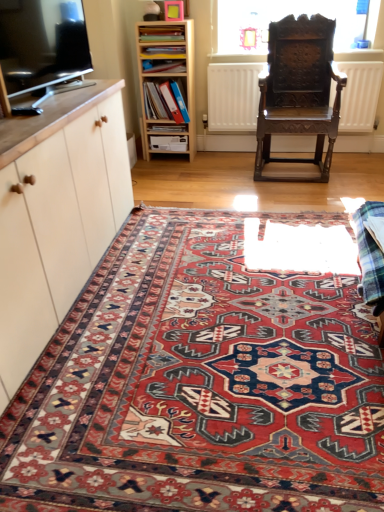
You are a GUI agent. You are given a task and a screenshot of the screen. Output one action in this format:
    pyautogui.click(x=<x>, y=<y>)
    Task: Click on the matte white cabinet at left
    This screenshot has width=384, height=512.
    Given the screenshot: What is the action you would take?
    pyautogui.click(x=58, y=218)

Image resolution: width=384 pixels, height=512 pixels. Identify the location of matte wooden bookshelf at upper center, the fourth book when ordered from bottom to top. (161, 33).

The width and height of the screenshot is (384, 512). What do you see at coordinates (299, 91) in the screenshot? I see `dark brown wood chair at center` at bounding box center [299, 91].

What do you see at coordinates (370, 253) in the screenshot?
I see `plaid fabric at lower right` at bounding box center [370, 253].

Image resolution: width=384 pixels, height=512 pixels. What do you see at coordinates (168, 128) in the screenshot? I see `matte cardboard book at center, the fourth book positioned from the top` at bounding box center [168, 128].

What do you see at coordinates (42, 42) in the screenshot? I see `black glossy tv at upper left` at bounding box center [42, 42].

Locate an element on the screen. matte white cabinet at left is located at coordinates (58, 218).

Is dark brown wood chair at center wider than matte plastic book at upper center, the 3th book in the bottom-to-top sequence?

Indeed, dark brown wood chair at center has a greater width compared to matte plastic book at upper center, the 3th book in the bottom-to-top sequence.

Is dark brown wood chair at center to the left or to the right of matte plastic book at upper center, acting as the 2th book starting from the top, in the image?

Based on their positions, dark brown wood chair at center is located to the right of matte plastic book at upper center, acting as the 2th book starting from the top.

From the picture: Which of these two, dark brown wood chair at center or matte plastic book at upper center, the 3th book in the bottom-to-top sequence, stands taller?

With more height is dark brown wood chair at center.

From the image's perspective, is dark brown wood chair at center located beneath matte plastic book at upper center, acting as the 2th book starting from the top?

Yes, from the image's perspective, dark brown wood chair at center is beneath matte plastic book at upper center, acting as the 2th book starting from the top.

From the image's perspective, relative to matte wooden bookshelf at upper center, the fourth book when ordered from bottom to top, is white matte radiator at center above or below?

white matte radiator at center is situated lower than matte wooden bookshelf at upper center, the fourth book when ordered from bottom to top, in the image.

Measure the distance between white matte radiator at center and matte wooden bookshelf at upper center, which appears as the first book when viewed from the top.

white matte radiator at center and matte wooden bookshelf at upper center, which appears as the first book when viewed from the top, are 21.80 inches apart from each other.

Visually, is white matte radiator at center positioned to the left or to the right of matte wooden bookshelf at upper center, the fourth book when ordered from bottom to top?

Clearly, white matte radiator at center is on the right of matte wooden bookshelf at upper center, the fourth book when ordered from bottom to top, in the image.

Where is `radiator that is under the matte wooden bookshelf at upper center, the fourth book when ordered from bottom to top (from a real-world perspective)`? The height and width of the screenshot is (512, 384). radiator that is under the matte wooden bookshelf at upper center, the fourth book when ordered from bottom to top (from a real-world perspective) is located at coordinates (233, 96).

Can you confirm if matte wooden bookshelf at upper center, the fourth book when ordered from bottom to top, is shorter than matte plastic book at upper center, acting as the 2th book starting from the top?

In fact, matte wooden bookshelf at upper center, the fourth book when ordered from bottom to top, may be taller than matte plastic book at upper center, acting as the 2th book starting from the top.

Is matte wooden bookshelf at upper center, which appears as the first book when viewed from the top, positioned with its back to matte plastic book at upper center, acting as the 2th book starting from the top?

No, matte plastic book at upper center, acting as the 2th book starting from the top, is not at the back of matte wooden bookshelf at upper center, which appears as the first book when viewed from the top.

Considering the sizes of matte wooden bookshelf at upper center, the fourth book when ordered from bottom to top, and matte plastic book at upper center, acting as the 2th book starting from the top, in the image, is matte wooden bookshelf at upper center, the fourth book when ordered from bottom to top, bigger or smaller than matte plastic book at upper center, acting as the 2th book starting from the top,?

Clearly, matte wooden bookshelf at upper center, the fourth book when ordered from bottom to top, is larger in size than matte plastic book at upper center, acting as the 2th book starting from the top.

Which is nearer, (x=180, y=35) or (x=165, y=52)?

Clearly, point (x=180, y=35) is closer to the camera than point (x=165, y=52).

Can you confirm if light wood shelf at upper center is shorter than plaid fabric at lower right?

In fact, light wood shelf at upper center may be taller than plaid fabric at lower right.

You are a GUI agent. You are given a task and a screenshot of the screen. Output one action in this format:
    pyautogui.click(x=<x>, y=<y>)
    Task: Click on the blanket below the light wood shelf at upper center (from the image's perspective)
    
    Given the screenshot: What is the action you would take?
    pyautogui.click(x=370, y=253)

What's the angular difference between light wood shelf at upper center and plaid fabric at lower right's facing directions?

The angle between the facing direction of light wood shelf at upper center and the facing direction of plaid fabric at lower right is 90 degrees.

Is point (145, 35) closer to camera compared to point (358, 292)?

No, it is not.

Which is behind, point (140, 58) or point (154, 128)?

Point (154, 128)

Between light wood shelf at upper center and matte cardboard book at center, the fourth book positioned from the top, which one has less height?

matte cardboard book at center, the fourth book positioned from the top, is shorter.

Measure the distance from light wood shelf at upper center to matte cardboard book at center, the fourth book positioned from the top.

They are 13.18 inches apart.

In the image, is light wood shelf at upper center positioned in front of or behind matte cardboard book at center, the fourth book positioned from the top?

Visually, light wood shelf at upper center is located in front of matte cardboard book at center, the fourth book positioned from the top.

Which point is more distant from viewer, (184, 65) or (127, 182)?

The point (184, 65) is behind.

Can you confirm if matte blue book at upper center, acting as the 3th book starting from the top, is positioned to the right of matte white cabinet at left?

Correct, you'll find matte blue book at upper center, acting as the 3th book starting from the top, to the right of matte white cabinet at left.

Consider the image. Does matte blue book at upper center, which appears as the second book when ordered from the bottom, have a larger size compared to matte white cabinet at left?

No, matte blue book at upper center, which appears as the second book when ordered from the bottom, is not bigger than matte white cabinet at left.

Is matte blue book at upper center, acting as the 3th book starting from the top, situated inside matte white cabinet at left or outside?

matte blue book at upper center, acting as the 3th book starting from the top, is not enclosed by matte white cabinet at left.

From a real-world perspective, does matte blue book at upper center, which appears as the second book when ordered from the bottom, stand above black glossy tv at upper left?

Incorrect, from a real-world perspective, matte blue book at upper center, which appears as the second book when ordered from the bottom, is lower than black glossy tv at upper left.

Is matte blue book at upper center, acting as the 3th book starting from the top, positioned far away from black glossy tv at upper left?

Indeed, matte blue book at upper center, acting as the 3th book starting from the top, is not near black glossy tv at upper left.

From the image's perspective, which one is positioned lower, matte blue book at upper center, acting as the 3th book starting from the top, or black glossy tv at upper left?

From the image's view, black glossy tv at upper left is below.

The image size is (384, 512). I want to click on chair on the right of matte plastic book at upper center, the 3th book in the bottom-to-top sequence, so coord(299,91).

Where is `the 3rd book above the white matte radiator at center (from a real-world perspective)`? the 3rd book above the white matte radiator at center (from a real-world perspective) is located at coordinates (161, 33).

Considering their positions, is matte wooden bookshelf at upper center, the fourth book when ordered from bottom to top, positioned further to matte blue book at upper center, which appears as the second book when ordered from the bottom, than light wood shelf at upper center?

The object further to matte blue book at upper center, which appears as the second book when ordered from the bottom, is light wood shelf at upper center.

Based on their spatial positions, is matte plastic book at upper center, acting as the 2th book starting from the top, or matte white cabinet at left closer to matte wooden bookshelf at upper center, which appears as the first book when viewed from the top?

matte plastic book at upper center, acting as the 2th book starting from the top, lies closer to matte wooden bookshelf at upper center, which appears as the first book when viewed from the top, than the other object.

Looking at the image, which one is located further to matte white cabinet at left, white matte radiator at center or dark brown wood chair at center?

white matte radiator at center is further to matte white cabinet at left.

Based on their spatial positions, is dark brown wood chair at center or matte white cabinet at left closer to white matte radiator at center?

dark brown wood chair at center lies closer to white matte radiator at center than the other object.

Based on their spatial positions, is matte wooden bookshelf at upper center, which appears as the first book when viewed from the top, or white matte radiator at center further from carpet with intricate patterns at center?

Based on the image, matte wooden bookshelf at upper center, which appears as the first book when viewed from the top, appears to be further to carpet with intricate patterns at center.

When comparing their distances from black glossy tv at upper left, does matte wooden bookshelf at upper center, which appears as the first book when viewed from the top, or light wood shelf at upper center seem further?

Based on the image, matte wooden bookshelf at upper center, which appears as the first book when viewed from the top, appears to be further to black glossy tv at upper left.

Based on their spatial positions, is matte blue book at upper center, which appears as the second book when ordered from the bottom, or black glossy tv at upper left further from matte white cabinet at left?

Based on the image, matte blue book at upper center, which appears as the second book when ordered from the bottom, appears to be further to matte white cabinet at left.

Based on their spatial positions, is white matte radiator at center or matte cardboard book at center, the fourth book positioned from the top, further from matte plastic book at upper center, acting as the 2th book starting from the top?

matte cardboard book at center, the fourth book positioned from the top, is positioned further to the anchor matte plastic book at upper center, acting as the 2th book starting from the top.

You are a GUI agent. You are given a task and a screenshot of the screen. Output one action in this format:
    pyautogui.click(x=<x>, y=<y>)
    Task: Click on the shelf between matte white cabinet at left and transparent glass window at upper center from front to back
    Image resolution: width=384 pixels, height=512 pixels.
    Given the screenshot: What is the action you would take?
    click(x=167, y=84)

Find the location of a particular element. radiator between matte plastic book at upper center, the 3th book in the bottom-to-top sequence, and transparent glass window at upper center, in the horizontal direction is located at coordinates (233, 96).

I want to click on shelf located between plaid fabric at lower right and matte blue book at upper center, acting as the 3th book starting from the top, in the depth direction, so click(x=167, y=84).

Where is `blanket between matte white cabinet at left and white matte radiator at center in the front-back direction`? This screenshot has width=384, height=512. blanket between matte white cabinet at left and white matte radiator at center in the front-back direction is located at coordinates (370, 253).